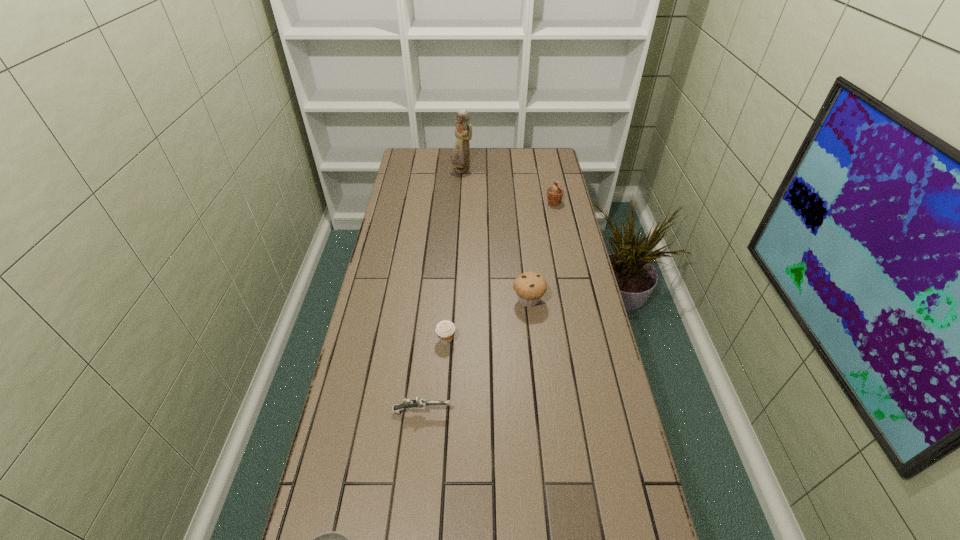
Find the location of a particular element. The width and height of the screenshot is (960, 540). vacant space situated on the front-facing side of the figurine is located at coordinates (461, 190).

You are a GUI agent. You are given a task and a screenshot of the screen. Output one action in this format:
    pyautogui.click(x=<x>, y=<y>)
    Task: Click on the free space located 0.360m on the left of the second nearest muffin
    The height and width of the screenshot is (540, 960).
    Given the screenshot: What is the action you would take?
    pyautogui.click(x=405, y=300)

At what (x,y) coordinates should I click in order to perform the action: click on free space located 0.130m on the front of the second farthest object. Please return your answer as a coordinate pair (x, y). Looking at the image, I should click on (559, 226).

At what (x,y) coordinates should I click in order to perform the action: click on vacant space located on the right of the leftmost muffin. Please return your answer as a coordinate pair (x, y). Looking at the image, I should click on [x=508, y=340].

The height and width of the screenshot is (540, 960). In order to click on vacant area situated 0.220m aimed along the barrel of the gun in this screenshot , I will do `click(532, 411)`.

Where is `object present at the far edge`? This screenshot has width=960, height=540. object present at the far edge is located at coordinates (460, 158).

In order to click on object that is at the left edge in this screenshot , I will do `click(419, 403)`.

In the image, there is a desktop. Where is `vacant space at the left edge`? This screenshot has height=540, width=960. vacant space at the left edge is located at coordinates (400, 308).

Image resolution: width=960 pixels, height=540 pixels. In order to click on vacant space at the right edge of the desktop in this screenshot , I will do `click(564, 274)`.

You are a GUI agent. You are given a task and a screenshot of the screen. Output one action in this format:
    pyautogui.click(x=<x>, y=<y>)
    Task: Click on the free space between the farthest muffin and the third shortest object
    The image size is (960, 540).
    Given the screenshot: What is the action you would take?
    pyautogui.click(x=500, y=271)